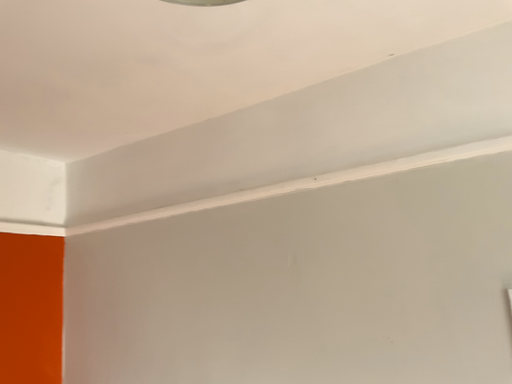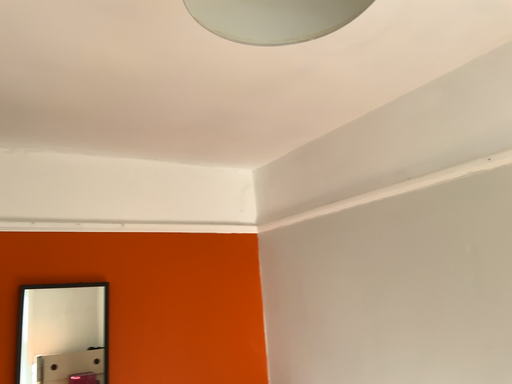
Question: Which way did the camera rotate in the video?

Choices:
 (A) rotated right
 (B) rotated left

Answer: (B)